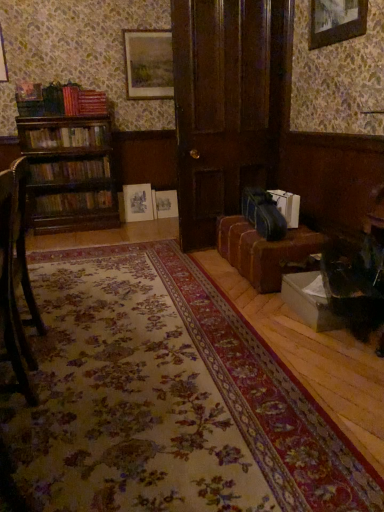
Locate an element on the screen. vacant point to the left of dark wood door at center is located at coordinates (153, 245).